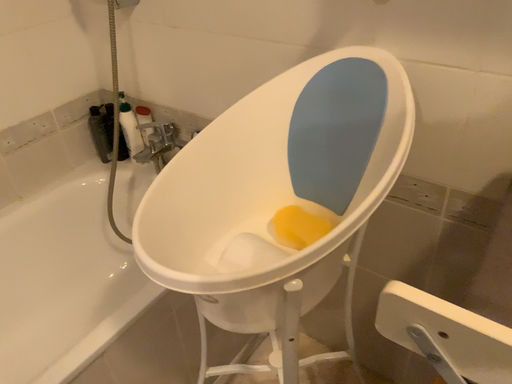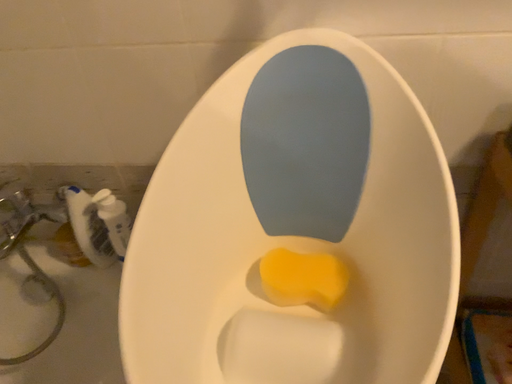
Question: How did the camera likely rotate when shooting the video?

Choices:
 (A) rotated right
 (B) rotated left

Answer: (A)